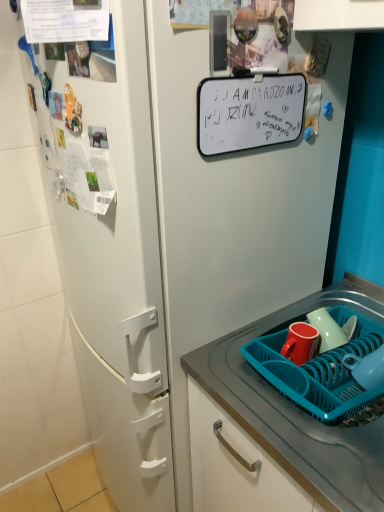
You are a GUI agent. You are given a task and a screenshot of the screen. Output one action in this format:
    pyautogui.click(x=<x>, y=<y>)
    Task: Click on the vacant space to the right of matte red mug at lower right
    
    Given the screenshot: What is the action you would take?
    pyautogui.click(x=356, y=345)